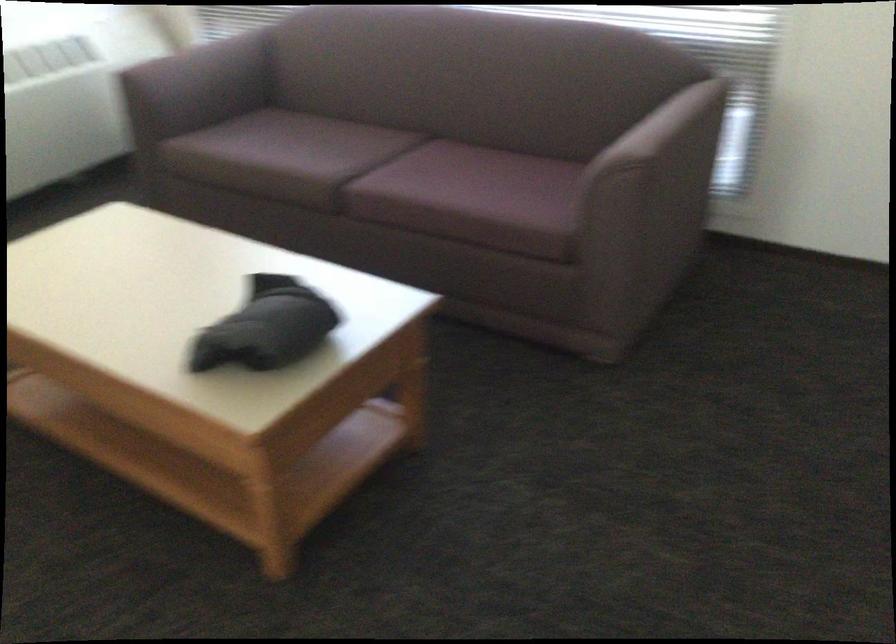
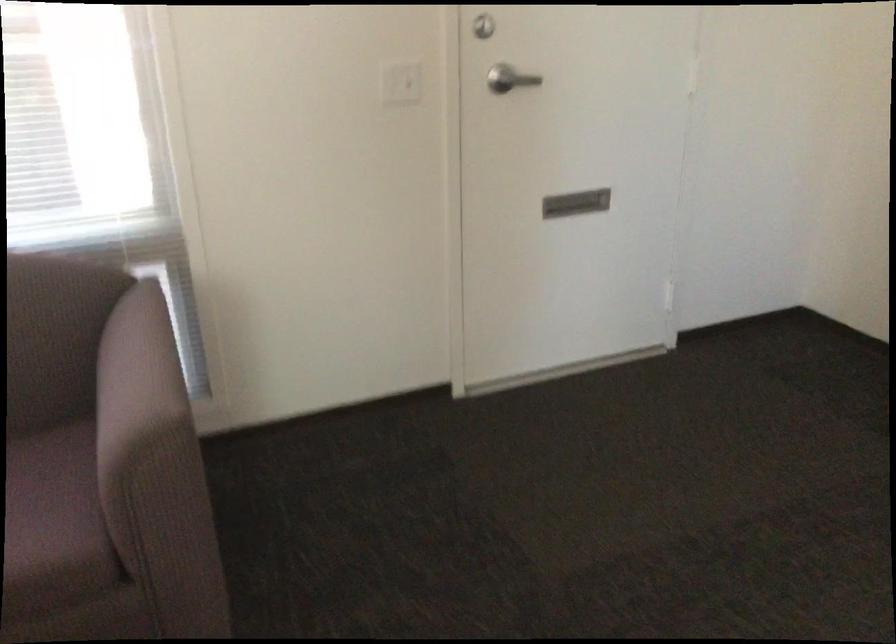
The point at (639, 129) is marked in the first image. Where is the corresponding point in the second image?

(136, 381)